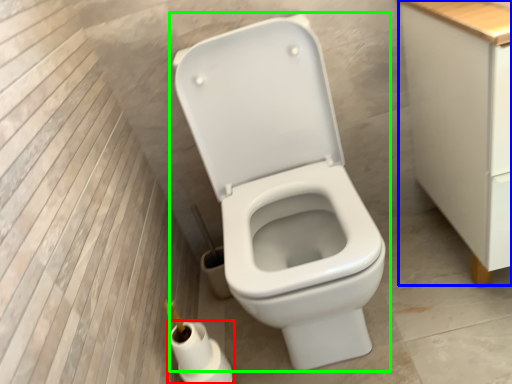
Question: Which object is the closest to the toilet paper (highlighted by a red box)? Choose among these: cabinetry (highlighted by a blue box) or toilet (highlighted by a green box).

Choices:
 (A) cabinetry
 (B) toilet

Answer: (B)